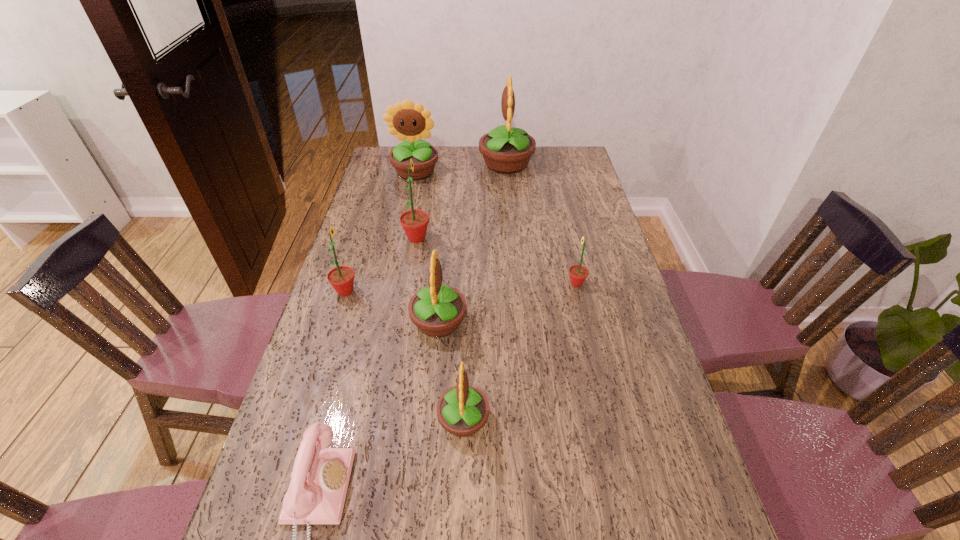
Identify the location of vacant space located 0.150m on the face of the smallest green sunflower. (517, 284).

The image size is (960, 540). What are the coordinates of `vacant area situated on the face of the smallest green sunflower` in the screenshot? It's located at (515, 284).

The width and height of the screenshot is (960, 540). Find the location of `free location located on the face of the smallest green sunflower`. free location located on the face of the smallest green sunflower is located at coordinates (505, 284).

Find the location of `object that is positioned at the right edge`. object that is positioned at the right edge is located at coordinates (x=578, y=273).

Where is `object present at the far left corner`? object present at the far left corner is located at coordinates (408, 121).

In order to click on free space at the left edge of the desktop in this screenshot , I will do `click(392, 192)`.

Where is `vacant region at the right edge of the desktop`? The width and height of the screenshot is (960, 540). vacant region at the right edge of the desktop is located at coordinates (654, 437).

Find the location of a particular element. vacant region at the far right corner is located at coordinates (545, 150).

Identify the location of vacant point located between the nearest yellow sunflower and the rightmost sunflower. This screenshot has height=540, width=960. (520, 352).

Where is `vacant area between the leftmost green sunflower and the nearest yellow sunflower`? vacant area between the leftmost green sunflower and the nearest yellow sunflower is located at coordinates (404, 355).